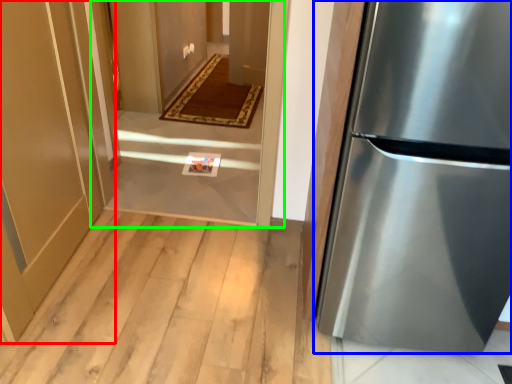
Question: Which object is the closest to the door (highlighted by a red box)? Choose among these: refrigerator (highlighted by a blue box) or corridor (highlighted by a green box).

Choices:
 (A) refrigerator
 (B) corridor

Answer: (B)